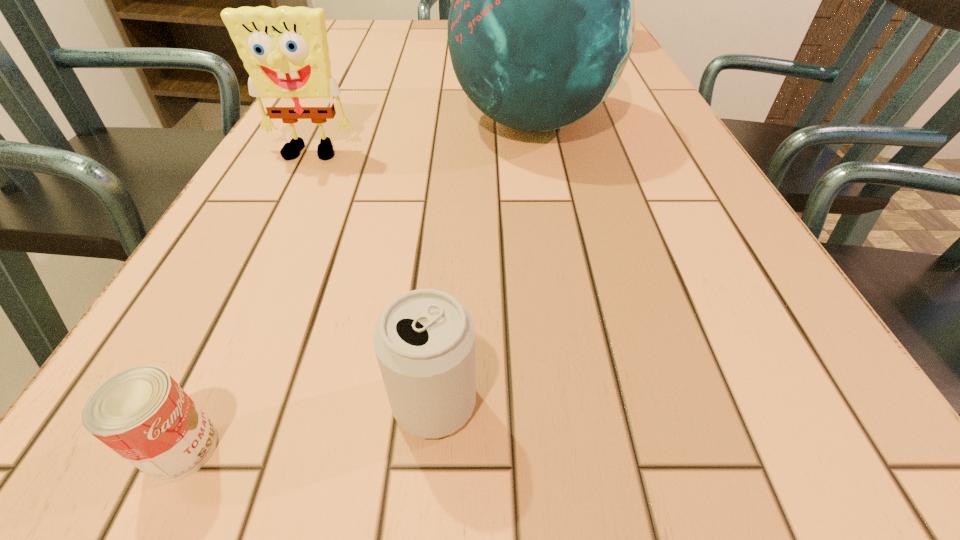
Image resolution: width=960 pixels, height=540 pixels. What are the coordinates of `sponge present at the left edge` in the screenshot? It's located at (285, 51).

Find the location of a particular element. This screenshot has width=960, height=540. can at the left edge is located at coordinates (141, 413).

Locate an element on the screen. The width and height of the screenshot is (960, 540). object that is positioned at the right edge is located at coordinates [541, 25].

Where is `free spot at the far edge of the desktop`? Image resolution: width=960 pixels, height=540 pixels. free spot at the far edge of the desktop is located at coordinates (446, 37).

At what (x,y) coordinates should I click in order to perform the action: click on free spot at the left edge of the desktop. Please return your answer as a coordinate pair (x, y). The image size is (960, 540). Looking at the image, I should click on (356, 121).

At what (x,y) coordinates should I click in order to perform the action: click on vacant space at the right edge. Please return your answer as a coordinate pair (x, y). Image resolution: width=960 pixels, height=540 pixels. Looking at the image, I should click on (678, 168).

You are a GUI agent. You are given a task and a screenshot of the screen. Output one action in this format:
    pyautogui.click(x=<x>, y=<y>)
    Task: Click on the blank region between the left can and the sponge
    Image resolution: width=960 pixels, height=540 pixels.
    Given the screenshot: What is the action you would take?
    pyautogui.click(x=246, y=302)

This screenshot has width=960, height=540. I want to click on free space between the taller can and the tallest object, so click(x=483, y=262).

The width and height of the screenshot is (960, 540). In order to click on free area in between the sponge and the right can in this screenshot , I will do `click(372, 279)`.

Identify which object is the third closest to the globe. Please provide its 2D coordinates. Your answer should be formatted as a tuple, i.e. [(x, y)], where the tuple contains the x and y coordinates of a point satisfying the conditions above.

[(141, 413)]